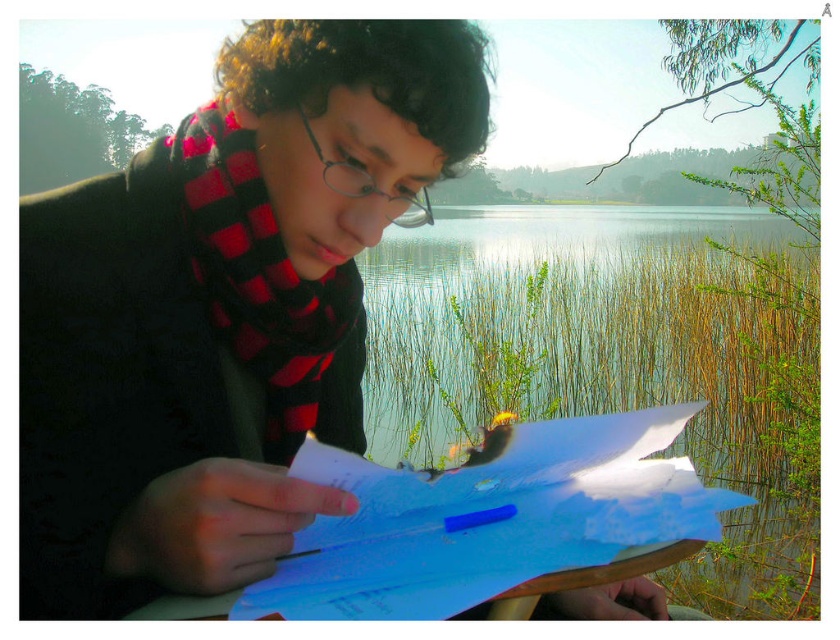
Can you confirm if clear water at center is positioned to the left of red plaid scarf at center?

In fact, clear water at center is to the right of red plaid scarf at center.

Between clear water at center and red plaid scarf at center, which one is positioned lower?

red plaid scarf at center

This screenshot has height=640, width=840. What do you see at coordinates (613, 356) in the screenshot?
I see `clear water at center` at bounding box center [613, 356].

Locate an element on the screen. clear water at center is located at coordinates (613, 356).

Is matte black scarf at upper left bigger than clear water at center?

Actually, matte black scarf at upper left might be smaller than clear water at center.

Is point (287, 72) more distant than point (718, 241)?

No, it is not.

Locate an element on the screen. matte black scarf at upper left is located at coordinates (222, 308).

Does matte black scarf at upper left appear on the left side of white paper at center?

Indeed, matte black scarf at upper left is positioned on the left side of white paper at center.

In order to click on matte black scarf at upper left in this screenshot , I will do `click(222, 308)`.

Identify the location of matte black scarf at upper left. (222, 308).

Image resolution: width=840 pixels, height=640 pixels. Identify the location of matte black scarf at upper left. (222, 308).